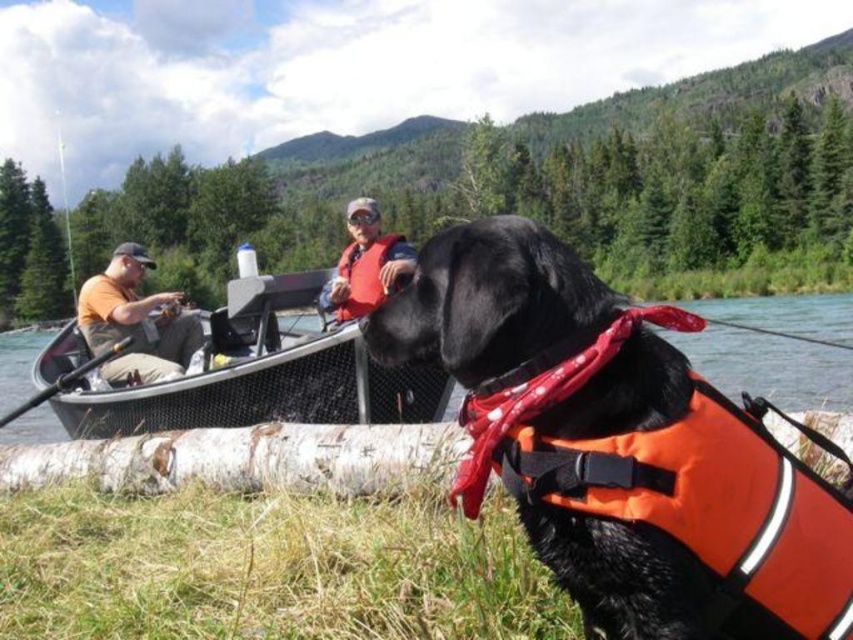
You are standing on the dock and see the white bark log at lower left and the black rubber boat at center. Which object is positioned to the right of the other?

The white bark log at lower left is to the right of the black rubber boat at center.